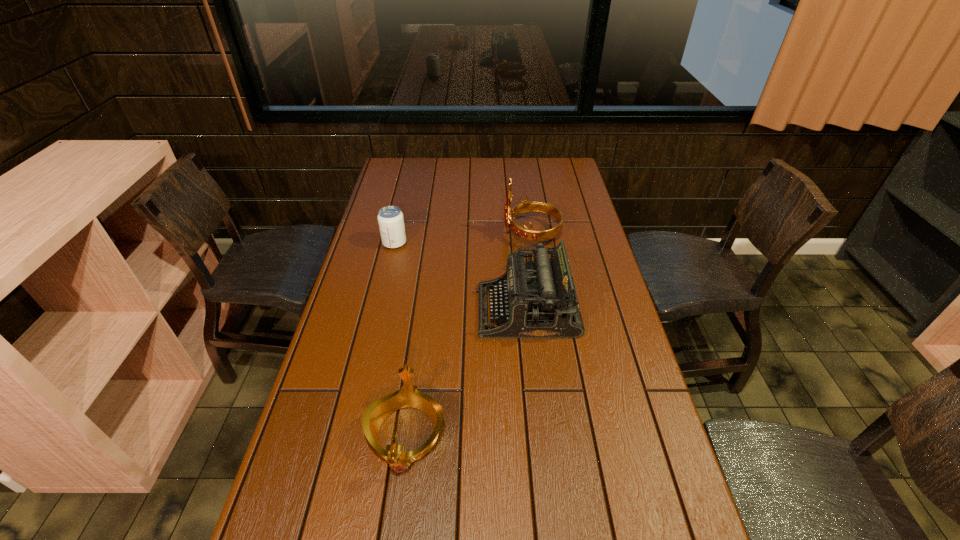
You are a GUI agent. You are given a task and a screenshot of the screen. Output one action in this format:
    pyautogui.click(x=<x>, y=<y>)
    Task: Click on the taller tiara
    This screenshot has height=540, width=960.
    Given the screenshot: What is the action you would take?
    pyautogui.click(x=525, y=233)

Locate an element on the screen. This screenshot has width=960, height=540. the right tiara is located at coordinates (525, 233).

In order to click on the third farthest object in this screenshot , I will do `click(539, 300)`.

Where is `typewriter`? typewriter is located at coordinates pos(539,300).

Where is `soda can`? soda can is located at coordinates (390, 219).

Locate an element on the screen. The width and height of the screenshot is (960, 540). the left tiara is located at coordinates (407, 396).

I want to click on the nearer tiara, so click(x=407, y=396).

At what (x,y) coordinates should I click in order to perform the action: click on free region located on the front-facing side of the taller tiara. Please return your answer as a coordinate pair (x, y). This screenshot has height=540, width=960. Looking at the image, I should click on (452, 233).

Find the location of a particular element. Image resolution: width=960 pixels, height=540 pixels. free space located on the front-facing side of the taller tiara is located at coordinates (411, 233).

Find the location of a particular element. The image size is (960, 540). free space located on the front-facing side of the taller tiara is located at coordinates (458, 233).